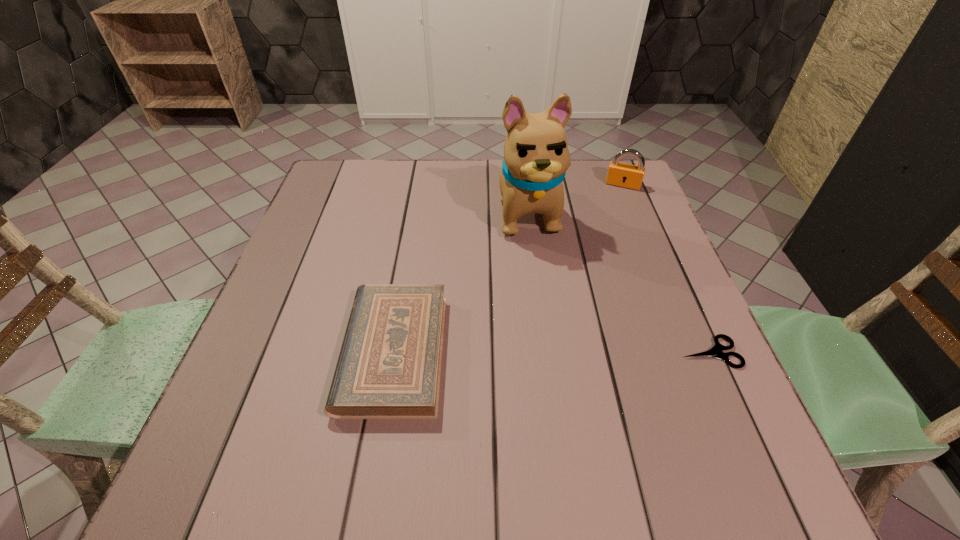
Where is `padlock that is at the right edge`? The width and height of the screenshot is (960, 540). padlock that is at the right edge is located at coordinates (619, 174).

This screenshot has height=540, width=960. I want to click on object present at the far right corner, so 619,174.

This screenshot has height=540, width=960. What are the coordinates of `vacant space at the far edge of the desktop` in the screenshot? It's located at (416, 187).

The height and width of the screenshot is (540, 960). Find the location of `free spot at the left edge of the desktop`. free spot at the left edge of the desktop is located at coordinates pos(334,240).

You are a GUI agent. You are given a task and a screenshot of the screen. Output one action in this format:
    pyautogui.click(x=<x>, y=<y>)
    Task: Click on the vacant region at the right edge of the desktop
    The width and height of the screenshot is (960, 540).
    Given the screenshot: What is the action you would take?
    pyautogui.click(x=621, y=210)

In the image, there is a desktop. Find the location of `vacant space at the far left corner`. vacant space at the far left corner is located at coordinates (344, 177).

Locate an element on the screen. This screenshot has height=540, width=960. free space at the near left corner of the desktop is located at coordinates (227, 418).

Locate an element on the screen. vacant area that lies between the padlock and the shortest object is located at coordinates (666, 268).

What are the coordinates of `empty space between the shears and the second tallest object` in the screenshot? It's located at (666, 268).

Where is `unoccupied position between the leftmost object and the third object from right to left`? unoccupied position between the leftmost object and the third object from right to left is located at coordinates (461, 281).